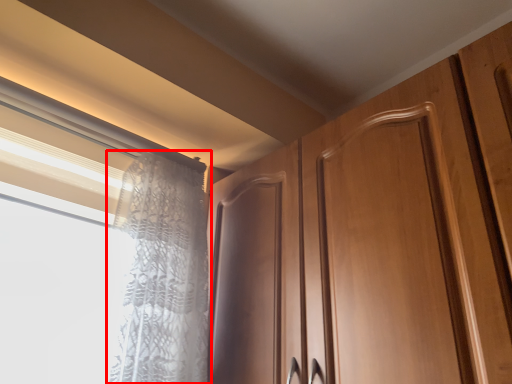
Question: From the image's perspective, where is curtain (annotated by the red box) located in relation to window in the image?

Choices:
 (A) below
 (B) above

Answer: (A)